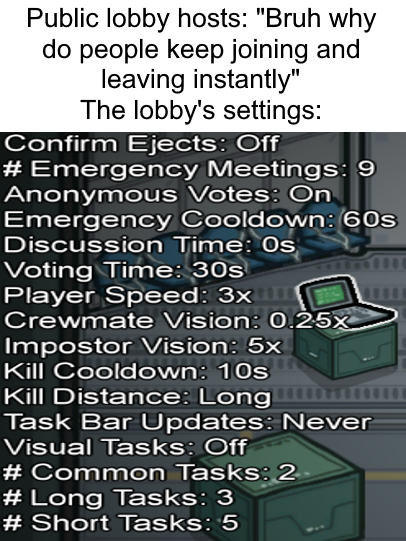
Locate an element on the screen. This screenshot has width=406, height=541. laptop computer is located at coordinates (348, 288).